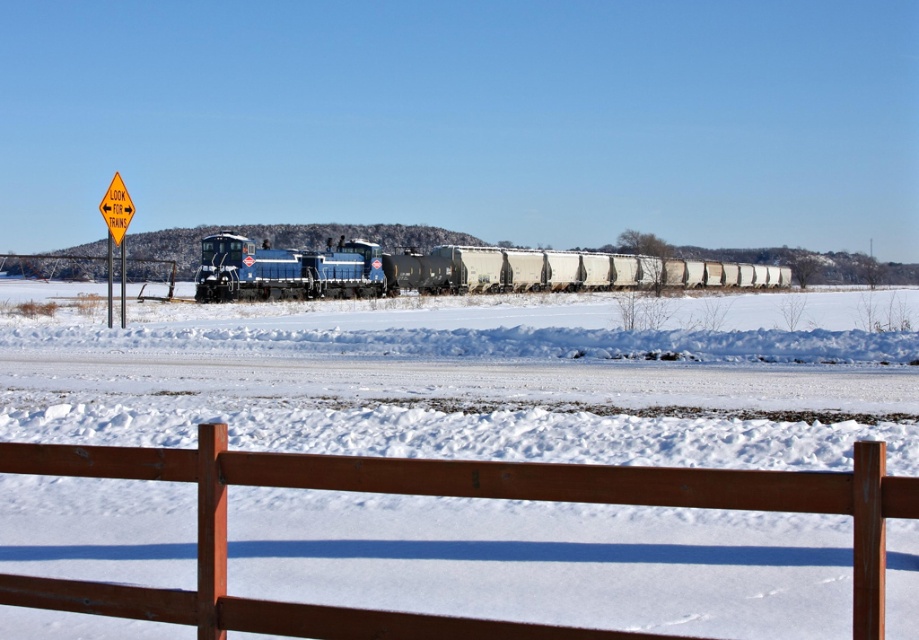
Can you confirm if brown wooden fence at lower center is shorter than blue matte train at center?

Yes.

Does brown wooden fence at lower center appear over blue matte train at center?

Incorrect, brown wooden fence at lower center is not positioned above blue matte train at center.

Identify the location of brown wooden fence at lower center. (437, 496).